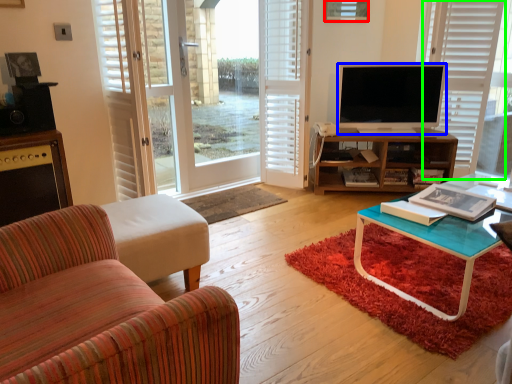
Question: Which is nearer to the picture frame (highlighted by a red box)? television (highlighted by a blue box) or blind (highlighted by a green box).

Choices:
 (A) television
 (B) blind

Answer: (A)